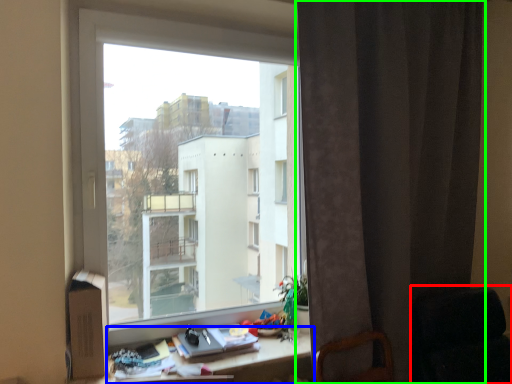
Question: Which object is the farthest from rocking chair (highlighted by a red box)? Choose among these: desk (highlighted by a blue box) or curtain (highlighted by a green box).

Choices:
 (A) desk
 (B) curtain

Answer: (A)